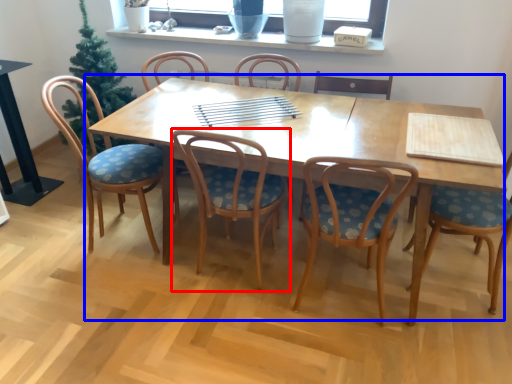
Question: Which point is closer to the camera, chair (highlighted by a red box) or kitchen & dining room table (highlighted by a blue box)?

Choices:
 (A) chair
 (B) kitchen & dining room table

Answer: (A)